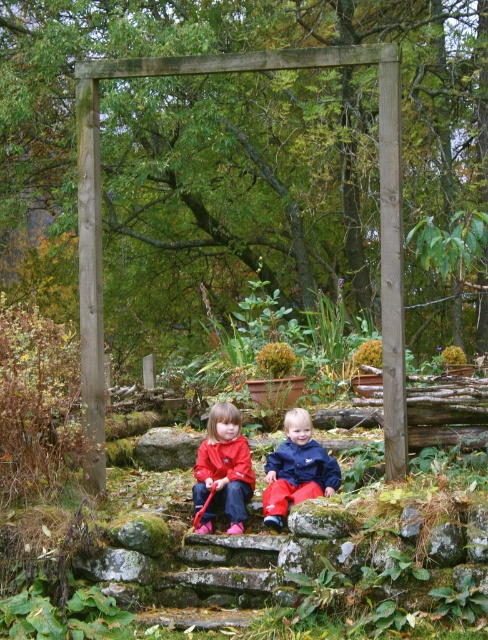
You are standing in a garden and see two points marked in the image. The first point is at coordinates point (x=242, y=435) and the second point is at point (x=331, y=480). Which point is closer to you?

Point (x=242, y=435) is closer to you since it is further to the viewer than point (x=331, y=480).

Consider the image. You are a photographer trying to capture both the matte red jacket at center and the matte blue jacket at center in a single shot. Based on their positions, which jacket should you focus on first to ensure both are in frame?

The matte red jacket at center is located below the matte blue jacket at center, so you should focus on the matte blue jacket at center first to ensure both are in frame.